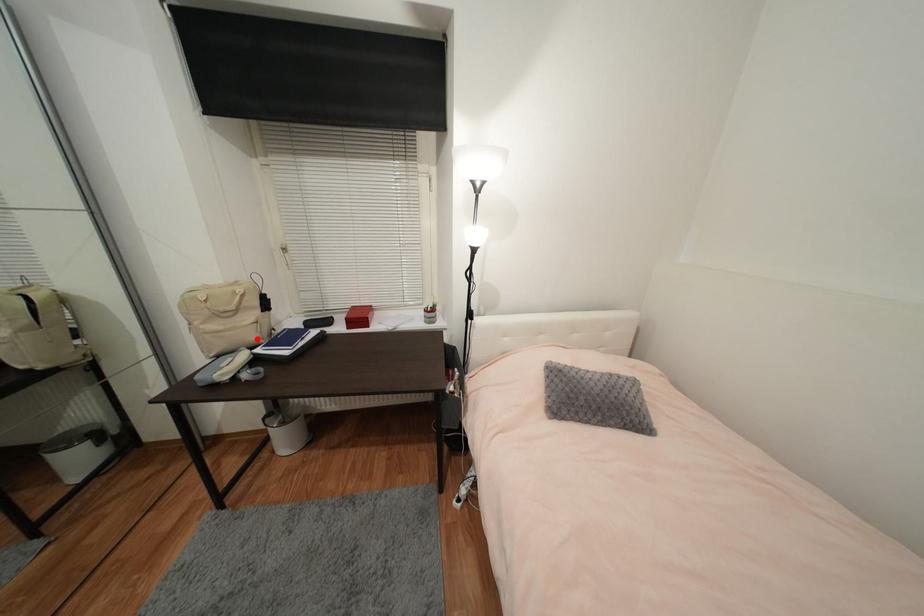
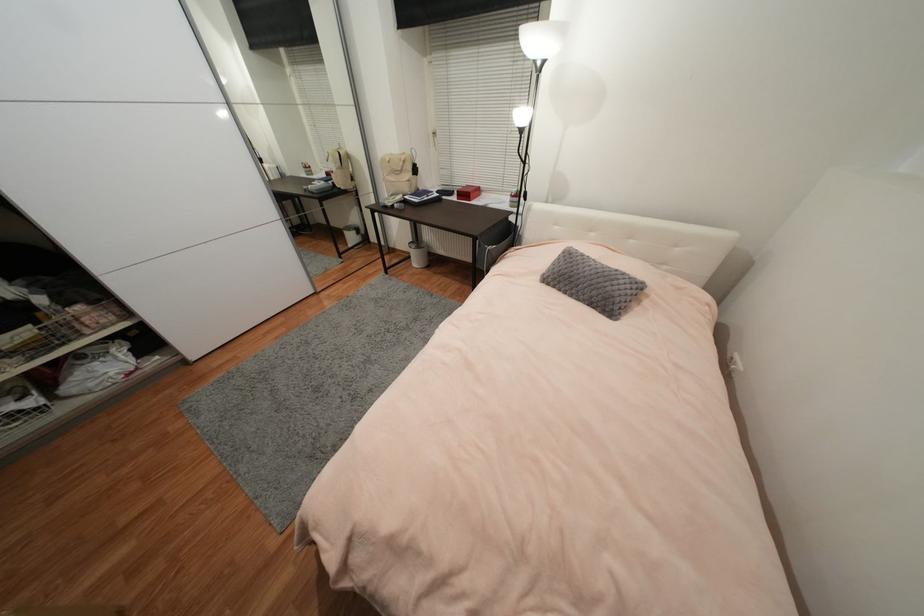
Question: I am providing you with two images of the same scene from different viewpoints. A red point is marked on the first image. Is the red point's position out of view in image 2?

Choices:
 (A) Yes
 (B) No

Answer: (B)